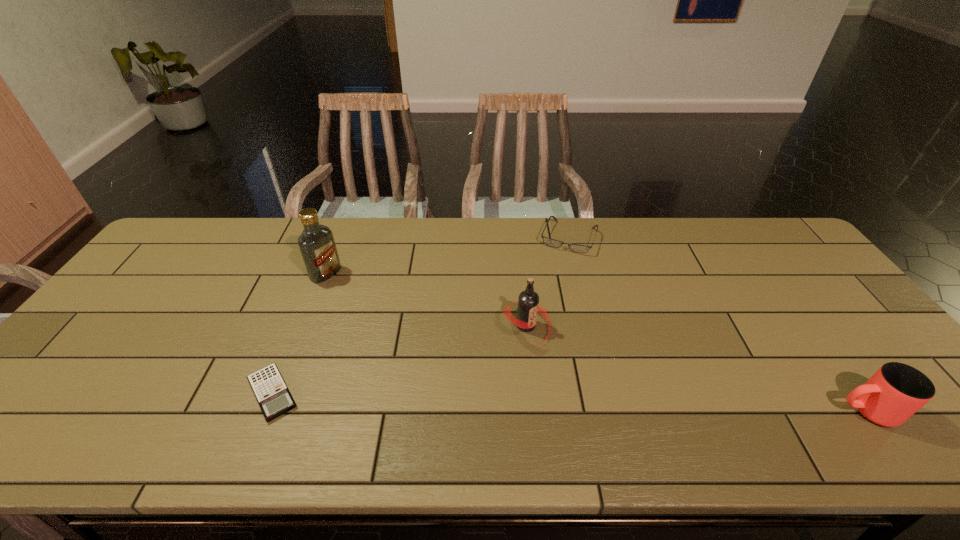
This screenshot has height=540, width=960. Find the location of `free spot located on the handle side of the third shortest object`. free spot located on the handle side of the third shortest object is located at coordinates (802, 411).

Where is `free location located on the handle side of the third shortest object`? The width and height of the screenshot is (960, 540). free location located on the handle side of the third shortest object is located at coordinates (802, 411).

At what (x,y) coordinates should I click in order to perform the action: click on free space located 0.280m on the handle side of the third shortest object. Please return your answer as a coordinate pair (x, y). This screenshot has width=960, height=540. Looking at the image, I should click on (712, 411).

The width and height of the screenshot is (960, 540). Find the location of `free space located 0.330m on the front-facing side of the farthest object`. free space located 0.330m on the front-facing side of the farthest object is located at coordinates (534, 328).

The image size is (960, 540). What are the coordinates of `vacant region located on the front-facing side of the farthest object` in the screenshot? It's located at (533, 330).

The width and height of the screenshot is (960, 540). What are the coordinates of `free region located on the front-facing side of the farthest object` in the screenshot? It's located at (530, 339).

At what (x,y) coordinates should I click in order to perform the action: click on vacant space located 0.230m on the label of the third object from right to left. Please return your answer as a coordinate pair (x, y). Looking at the image, I should click on (x=618, y=403).

Where is `vacant region located on the label of the third object from right to left`? The width and height of the screenshot is (960, 540). vacant region located on the label of the third object from right to left is located at coordinates (590, 381).

This screenshot has height=540, width=960. I want to click on vacant region located on the label of the third object from right to left, so click(562, 358).

Identify the location of vacant space located on the front-facing side of the vodka. The image size is (960, 540). (426, 334).